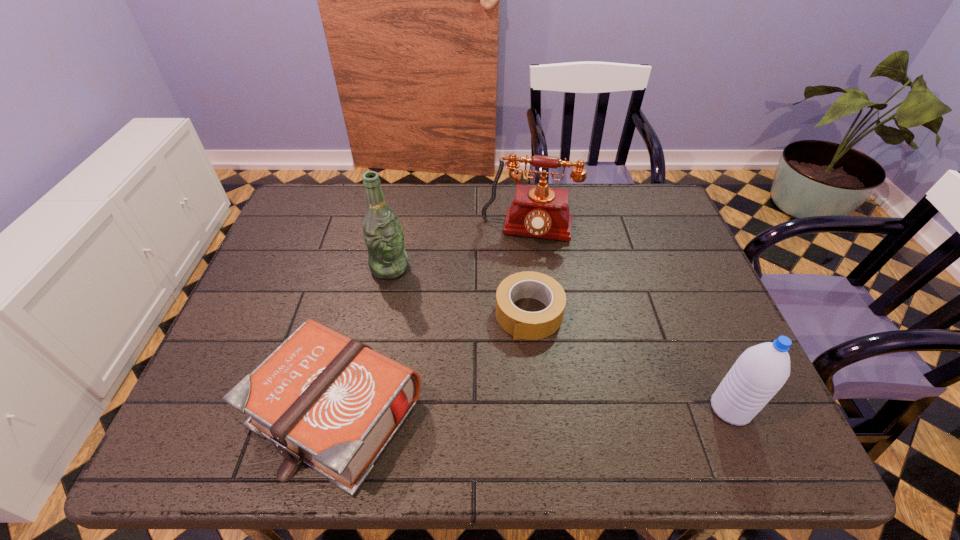
Locate an element on the screen. Image resolution: width=960 pixels, height=540 pixels. vacant spot on the desktop that is between the second shortest object and the rightmost object and is positioned on the surface of the fourth nearest object is located at coordinates (560, 410).

The height and width of the screenshot is (540, 960). Find the location of `free spot on the desktop that is between the Bible and the rightmost object and is positioned on the dial of the telephone`. free spot on the desktop that is between the Bible and the rightmost object and is positioned on the dial of the telephone is located at coordinates (501, 410).

This screenshot has width=960, height=540. What are the coordinates of `free space on the desktop that is between the Bible and the water bottle and is positioned at the edge of the duct tape` in the screenshot? It's located at (487, 410).